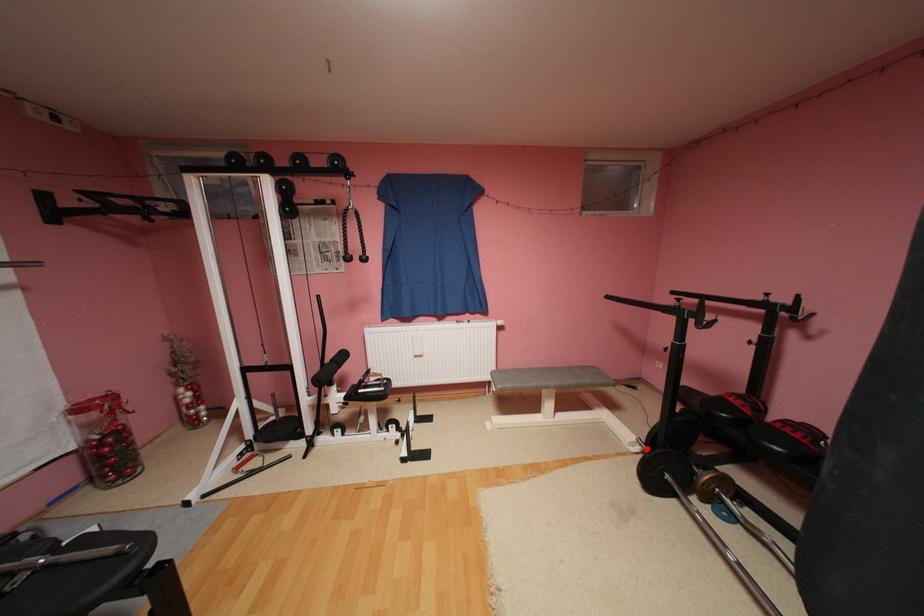
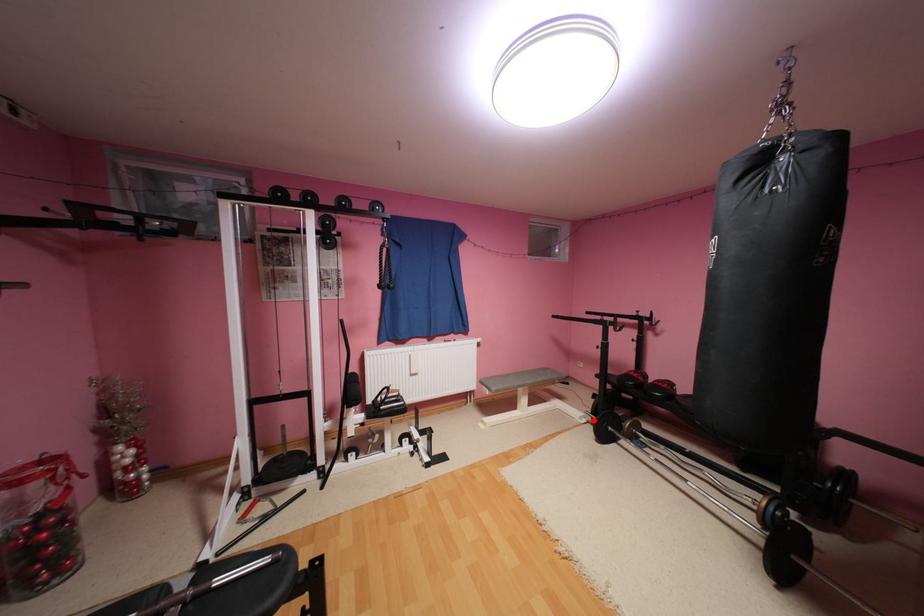
I am providing you with two images of the same scene from different viewpoints. A red point is marked on the first image and another point is marked on the second image. Do the highlighted points in image1 and image2 indicate the same real-world spot?

Yes